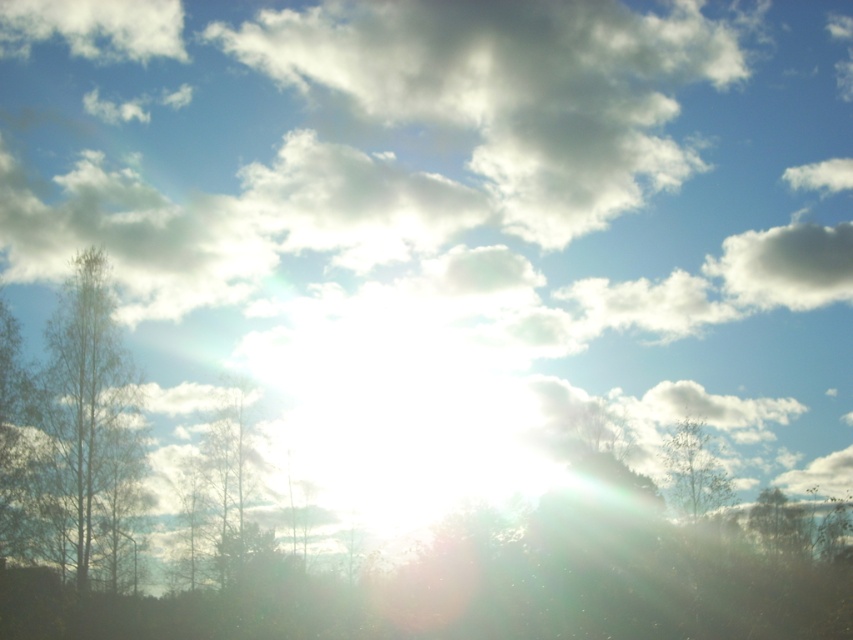
Question: Is green matte tree at left further to camera compared to green leafy tree at right?

Choices:
 (A) yes
 (B) no

Answer: (A)

Question: Does green matte tree at left lie behind white fluffy cloud at upper right?

Choices:
 (A) no
 (B) yes

Answer: (A)

Question: Which object is farther from the camera taking this photo?

Choices:
 (A) green leafy tree at right
 (B) green matte tree at left
 (C) white fluffy cloud at upper left
 (D) white fluffy cloud at upper center

Answer: (C)

Question: Estimate the real-world distances between objects in this image. Which object is farther from the white fluffy cloud at upper center?

Choices:
 (A) white fluffy cloud at upper right
 (B) green leafy tree at right

Answer: (B)

Question: Is green leafy tree at left further to the viewer compared to white fluffy cloud at upper left?

Choices:
 (A) yes
 (B) no

Answer: (B)

Question: Which object is positioned closest to the white fluffy cloud at upper left?

Choices:
 (A) white fluffy cloud at upper center
 (B) green leafy tree at right
 (C) green matte tree at left

Answer: (A)